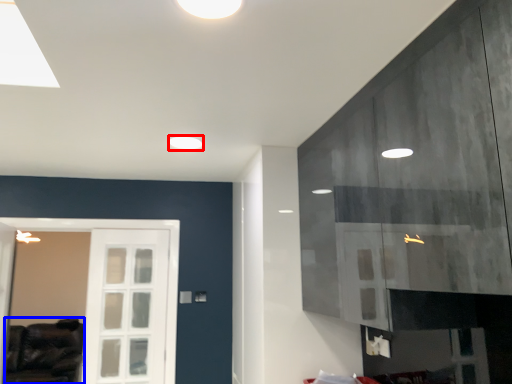
Question: Which point is further to the camera, lighting (highlighted by a red box) or furniture (highlighted by a blue box)?

Choices:
 (A) lighting
 (B) furniture

Answer: (B)